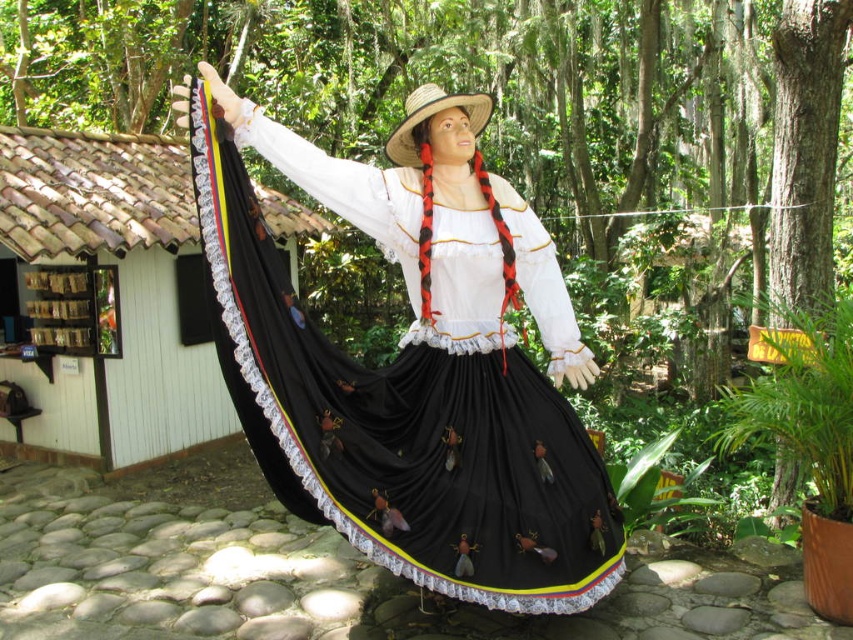
Based on the photo, does black satin dress at center appear on the left side of straw hat at center?

Indeed, black satin dress at center is positioned on the left side of straw hat at center.

Can you confirm if black satin dress at center is shorter than straw hat at center?

No, black satin dress at center is not shorter than straw hat at center.

Is point (489, 419) closer to camera compared to point (415, 102)?

Yes.

Where is `black satin dress at center`? black satin dress at center is located at coordinates (412, 369).